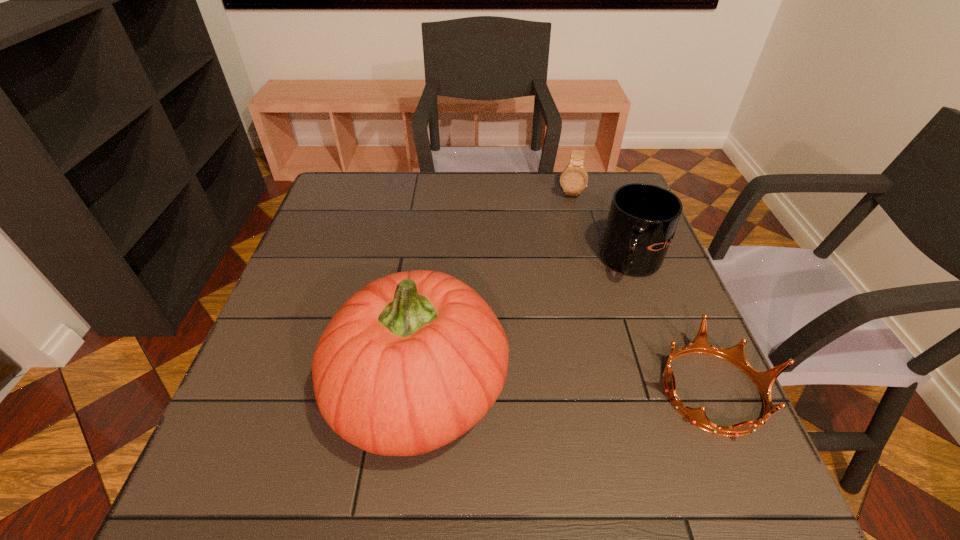
Locate an element on the screen. This screenshot has width=960, height=540. free space located 0.220m with the handle on the side of the mug is located at coordinates (571, 341).

The width and height of the screenshot is (960, 540). I want to click on free space located 0.310m with the handle on the side of the mug, so pos(548,368).

This screenshot has width=960, height=540. I want to click on vacant space located 0.230m on the face of the farthest object, so click(x=564, y=252).

Locate an element on the screen. The image size is (960, 540). free point located on the face of the farthest object is located at coordinates (565, 229).

Locate an element on the screen. This screenshot has height=540, width=960. blank space located on the face of the farthest object is located at coordinates (566, 227).

Where is `object present at the far edge`? The height and width of the screenshot is (540, 960). object present at the far edge is located at coordinates (574, 178).

The width and height of the screenshot is (960, 540). What are the coordinates of `pumpkin positioned at the near edge` in the screenshot? It's located at (412, 361).

At what (x,y) coordinates should I click in order to perform the action: click on crown that is at the near edge. Please return your answer as a coordinate pair (x, y). Looking at the image, I should click on point(764,381).

Where is `crown located in the right edge section of the desktop`? This screenshot has height=540, width=960. crown located in the right edge section of the desktop is located at coordinates (764, 381).

Locate an element on the screen. This screenshot has height=540, width=960. mug located at the right edge is located at coordinates pos(641,224).